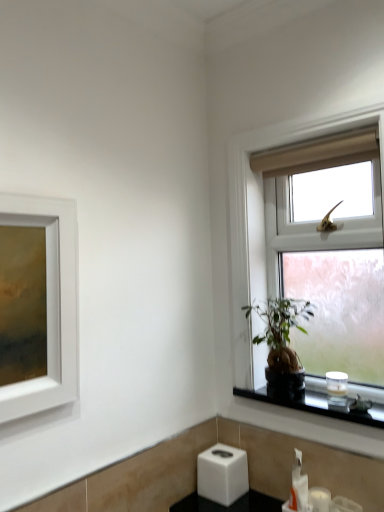
Question: Considering the relative positions of green leafy plant at window and white plastic soap dispenser at lower right in the image provided, is green leafy plant at window in front of white plastic soap dispenser at lower right?

Choices:
 (A) no
 (B) yes

Answer: (B)

Question: From the image's perspective, is green leafy plant at window beneath white plastic soap dispenser at lower right?

Choices:
 (A) yes
 (B) no

Answer: (B)

Question: Is green leafy plant at window to the right of white plastic soap dispenser at lower right from the viewer's perspective?

Choices:
 (A) no
 (B) yes

Answer: (A)

Question: Is green leafy plant at window facing towards white plastic soap dispenser at lower right?

Choices:
 (A) no
 (B) yes

Answer: (A)

Question: Is white plastic soap dispenser at lower right at the back of green leafy plant at window?

Choices:
 (A) yes
 (B) no

Answer: (B)

Question: From a real-world perspective, is green leafy plant at window physically above white plastic soap dispenser at lower right?

Choices:
 (A) no
 (B) yes

Answer: (B)

Question: From a real-world perspective, is black glass candle at right located beneath green leafy plant at window?

Choices:
 (A) yes
 (B) no

Answer: (A)

Question: Is black glass candle at right smaller than green leafy plant at window?

Choices:
 (A) yes
 (B) no

Answer: (A)

Question: Is the position of black glass candle at right less distant than that of green leafy plant at window?

Choices:
 (A) no
 (B) yes

Answer: (B)

Question: From the image's perspective, is black glass candle at right under green leafy plant at window?

Choices:
 (A) yes
 (B) no

Answer: (A)

Question: Does black glass candle at right have a lesser width compared to green leafy plant at window?

Choices:
 (A) yes
 (B) no

Answer: (B)

Question: Is black glass candle at right next to green leafy plant at window and touching it?

Choices:
 (A) no
 (B) yes

Answer: (A)

Question: Is green leafy plant at window taller than clear glass window at upper right?

Choices:
 (A) yes
 (B) no

Answer: (B)